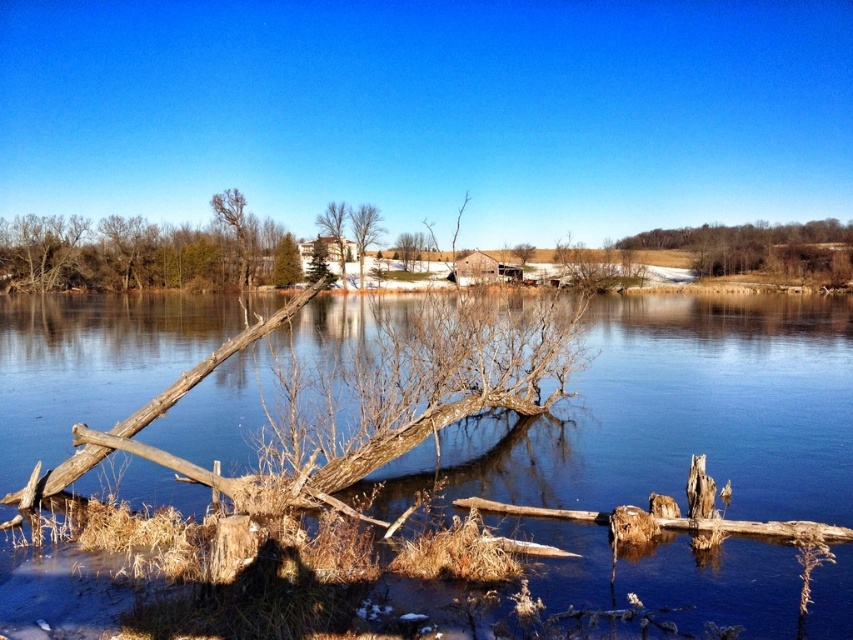
You are an artist planning to paint the scene. You want to ensure the sizes of the bare wood tree at upper left and the brown rough tree trunk at center are proportionally accurate. Which one should you draw larger?

The bare wood tree at upper left should be drawn larger because it is bigger than the brown rough tree trunk at center according to the description.

In the scene shown: You are planning to build a small shed in your backyard. You want to ensure it won not block the view of the smooth white house at center from the brown rough tree at upper right. Given their sizes, which object should you place closer to the shed to maintain the view?

The brown rough tree at upper right is bigger than the smooth white house at center, so to maintain the view of the smooth white house at center from the brown rough tree at upper right, you should place the shed closer to the brown rough tree at upper right. This way, the larger tree can potentially block the shed from obstructing the view of the smaller house.

You are a painter setting up your easel to paint the scene. You want to ensure the green matte tree at center and the brown rough tree trunk at center are proportionally accurate. Based on their sizes in the image, which object should you paint first to establish the scale?

The brown rough tree trunk at center should be painted first since it is larger than the green matte tree at center, establishing the scale before adding smaller details.